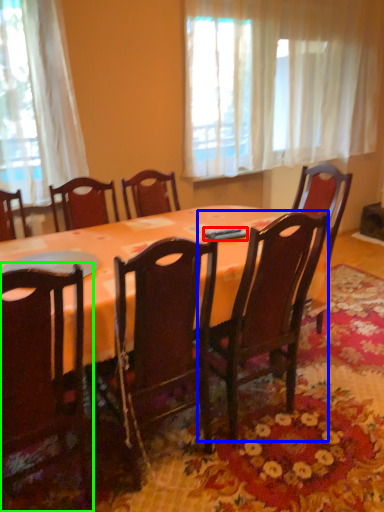
Question: Which object is the farthest from remote control (highlighted by a red box)? Choose among these: chair (highlighted by a blue box) or chair (highlighted by a green box).

Choices:
 (A) chair
 (B) chair

Answer: (B)